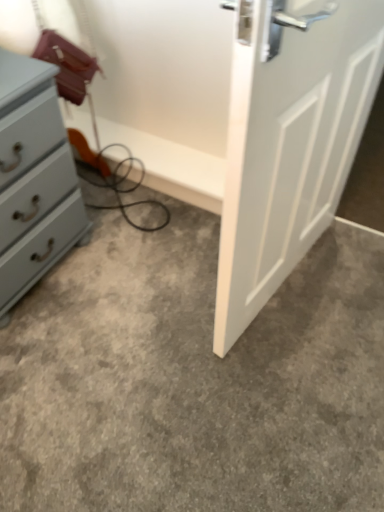
Question: Does gray carpet at center have a greater width compared to matte gray chest of drawers at left?

Choices:
 (A) no
 (B) yes

Answer: (B)

Question: Considering the relative sizes of gray carpet at center and matte gray chest of drawers at left in the image provided, is gray carpet at center smaller than matte gray chest of drawers at left?

Choices:
 (A) no
 (B) yes

Answer: (B)

Question: Would you say gray carpet at center is a long distance from matte gray chest of drawers at left?

Choices:
 (A) yes
 (B) no

Answer: (B)

Question: Can you confirm if gray carpet at center is thinner than matte gray chest of drawers at left?

Choices:
 (A) no
 (B) yes

Answer: (A)

Question: Is gray carpet at center positioned beyond the bounds of matte gray chest of drawers at left?

Choices:
 (A) yes
 (B) no

Answer: (A)

Question: From a real-world perspective, is gray carpet at center beneath matte gray chest of drawers at left?

Choices:
 (A) yes
 (B) no

Answer: (A)

Question: Would you say matte gray chest of drawers at left is outside gray carpet at center?

Choices:
 (A) no
 (B) yes

Answer: (B)

Question: Can you see matte gray chest of drawers at left touching gray carpet at center?

Choices:
 (A) yes
 (B) no

Answer: (B)

Question: Is gray carpet at center surrounded by matte gray chest of drawers at left?

Choices:
 (A) no
 (B) yes

Answer: (A)

Question: Is matte gray chest of drawers at left wider than gray carpet at center?

Choices:
 (A) no
 (B) yes

Answer: (A)

Question: From a real-world perspective, is matte gray chest of drawers at left beneath gray carpet at center?

Choices:
 (A) yes
 (B) no

Answer: (B)

Question: Are matte gray chest of drawers at left and gray carpet at center located far from each other?

Choices:
 (A) yes
 (B) no

Answer: (B)

Question: Is point (299, 441) closer or farther from the camera than point (4, 67)?

Choices:
 (A) closer
 (B) farther

Answer: (B)